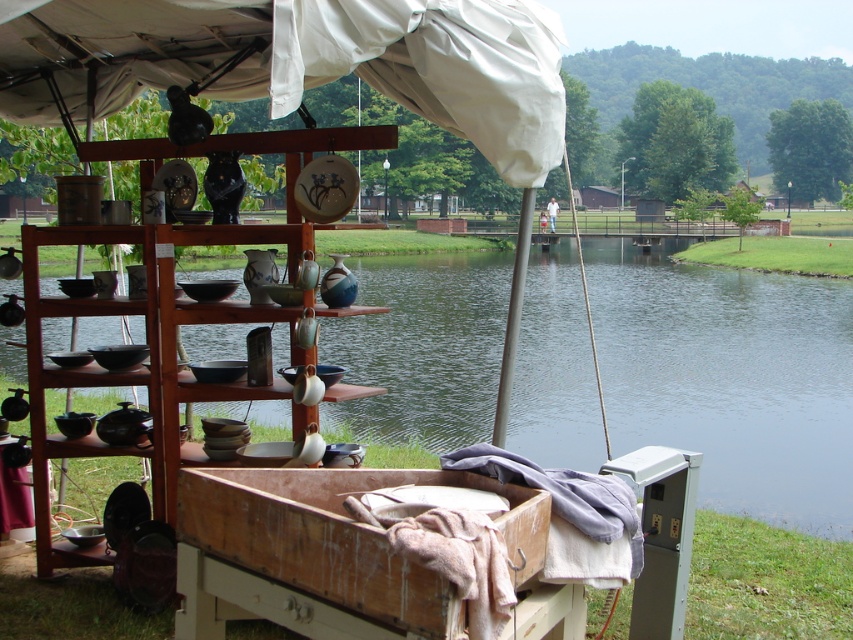
Question: Observing the image, what is the correct spatial positioning of wooden crate at lower center in reference to wooden shelves at center?

Choices:
 (A) above
 (B) below

Answer: (B)

Question: Which object is farther from the camera taking this photo?

Choices:
 (A) wooden crate at lower center
 (B) wooden shelves at center

Answer: (B)

Question: Can you confirm if smooth water at center is positioned to the right of wooden crate at lower center?

Choices:
 (A) no
 (B) yes

Answer: (A)

Question: Is smooth water at center to the left of wooden shelves at center from the viewer's perspective?

Choices:
 (A) yes
 (B) no

Answer: (A)

Question: Estimate the real-world distances between objects in this image. Which object is farther from the wooden shelves at center?

Choices:
 (A) smooth water at center
 (B) wooden crate at lower center

Answer: (A)

Question: Which object is the closest to the wooden crate at lower center?

Choices:
 (A) wooden shelves at center
 (B) smooth water at center

Answer: (A)